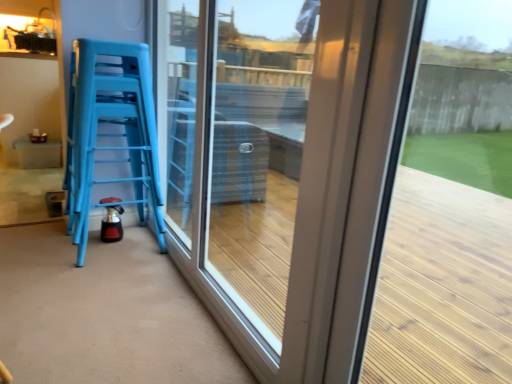
Question: From the image's perspective, is blue plastic stools at left beneath transparent glass door at center?

Choices:
 (A) yes
 (B) no

Answer: (B)

Question: Does blue plastic stools at left have a smaller size compared to transparent glass door at center?

Choices:
 (A) no
 (B) yes

Answer: (B)

Question: From a real-world perspective, is blue plastic stools at left located higher than transparent glass door at center?

Choices:
 (A) yes
 (B) no

Answer: (B)

Question: Does blue plastic stools at left have a lesser height compared to transparent glass door at center?

Choices:
 (A) no
 (B) yes

Answer: (B)

Question: Considering the relative positions of blue plastic stools at left and transparent glass door at center in the image provided, is blue plastic stools at left to the right of transparent glass door at center from the viewer's perspective?

Choices:
 (A) yes
 (B) no

Answer: (B)

Question: From a real-world perspective, is blue plastic stools at left under transparent glass door at center?

Choices:
 (A) yes
 (B) no

Answer: (A)

Question: Is transparent glass door at center next to blue plastic stools at left and touching it?

Choices:
 (A) no
 (B) yes

Answer: (A)

Question: From a real-world perspective, is transparent glass door at center beneath blue plastic stools at left?

Choices:
 (A) no
 (B) yes

Answer: (A)

Question: Are transparent glass door at center and blue plastic stools at left far apart?

Choices:
 (A) yes
 (B) no

Answer: (B)

Question: Is blue plastic stools at left surrounded by transparent glass door at center?

Choices:
 (A) yes
 (B) no

Answer: (B)

Question: Can we say transparent glass door at center lies outside blue plastic stools at left?

Choices:
 (A) no
 (B) yes

Answer: (B)

Question: Can you confirm if transparent glass door at center is wider than blue plastic stools at left?

Choices:
 (A) no
 (B) yes

Answer: (A)

Question: From a real-world perspective, is blue plastic stools at left physically located above or below transparent glass door at center?

Choices:
 (A) below
 (B) above

Answer: (A)